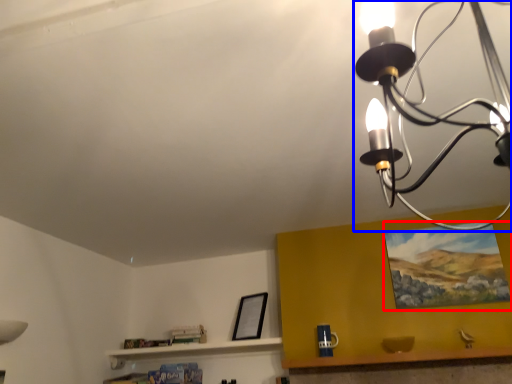
Question: Which object appears farthest to the camera in this image, picture frame (highlighted by a red box) or lamp (highlighted by a blue box)?

Choices:
 (A) picture frame
 (B) lamp

Answer: (A)